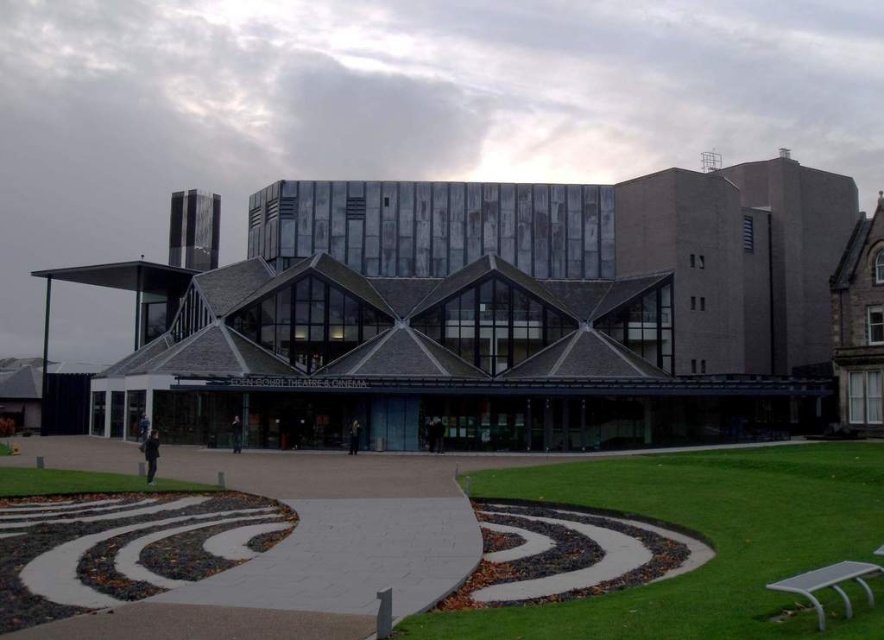
You are a visitor approaching the theater from the front entrance. As you walk towards the entrance, which object will you see first between the dark gray concrete building at center and the green grass at center?

You will see the dark gray concrete building at center first because it is in front of the green grass at center.

You are standing at the entrance of the dark gray concrete building at center. Looking down, you see the green grass at lower left. Which object is closer to your feet?

The green grass at lower left is closer to your feet because it is located at the lower left area, which is typically closer to the observer when standing at the entrance.

You are planning to install a new pathway between the green grass at center and the green grass at lower left. Considering their sizes, which area of green grass would require more sod rolls for landscaping?

The green grass at center requires more sod rolls because it is bigger than the green grass at lower left.